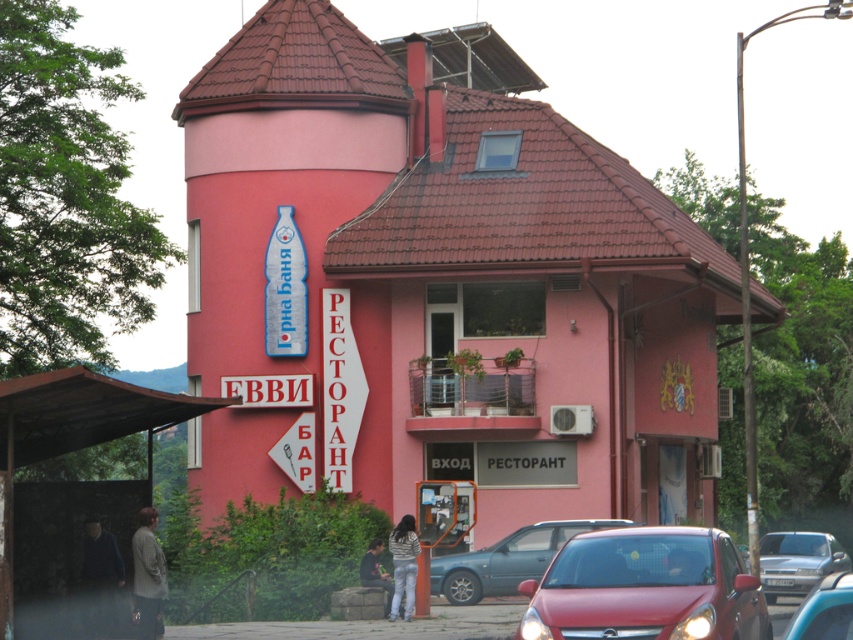
You are a pedestrian standing in front of the matte pink building at center. You want to cross the street to reach a park on the other side. Is the shiny red car at lower right blocking your path?

The shiny red car at lower right is behind the matte pink building at center, so it is not blocking your path. You can safely cross the street.